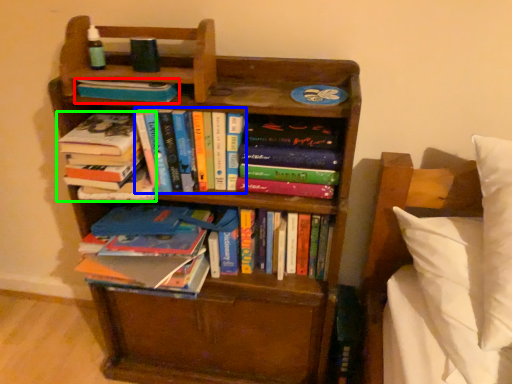
Question: Which object is positioned closest to book (highlighted by a red box)? Select from book (highlighted by a blue box) and book (highlighted by a green box).

Choices:
 (A) book
 (B) book

Answer: (A)